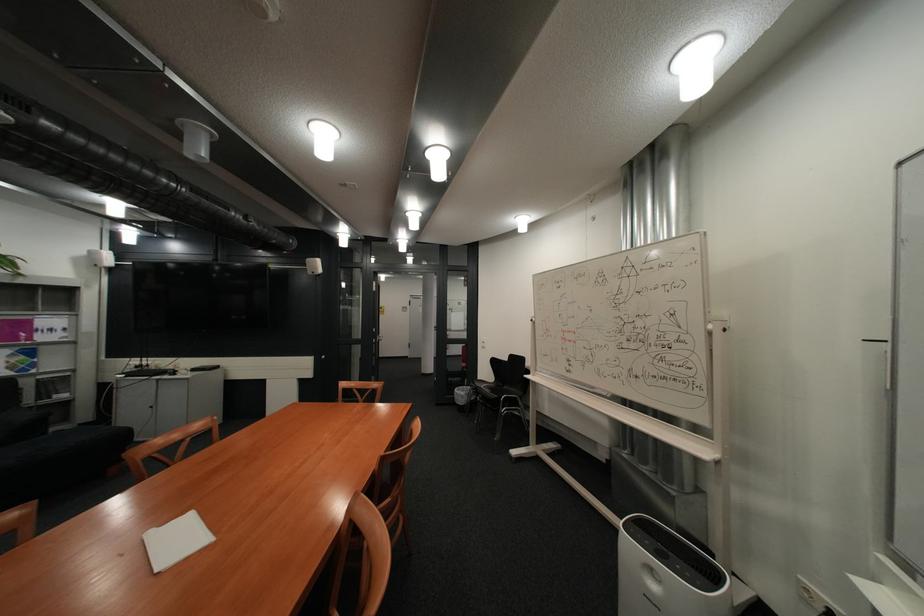
Identify the location of metal door handle. (434, 329).